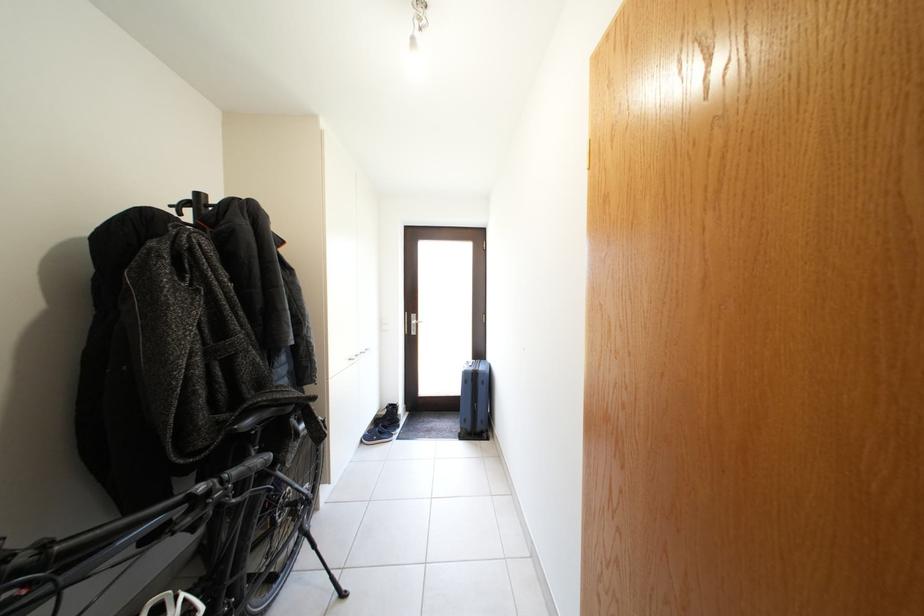
Identify the location of white cabinet handle. (410, 323).